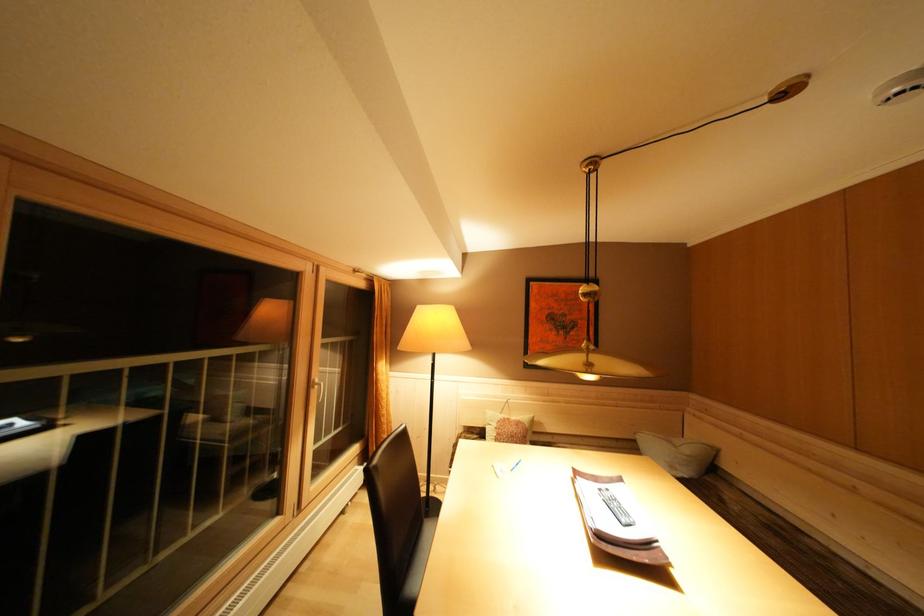
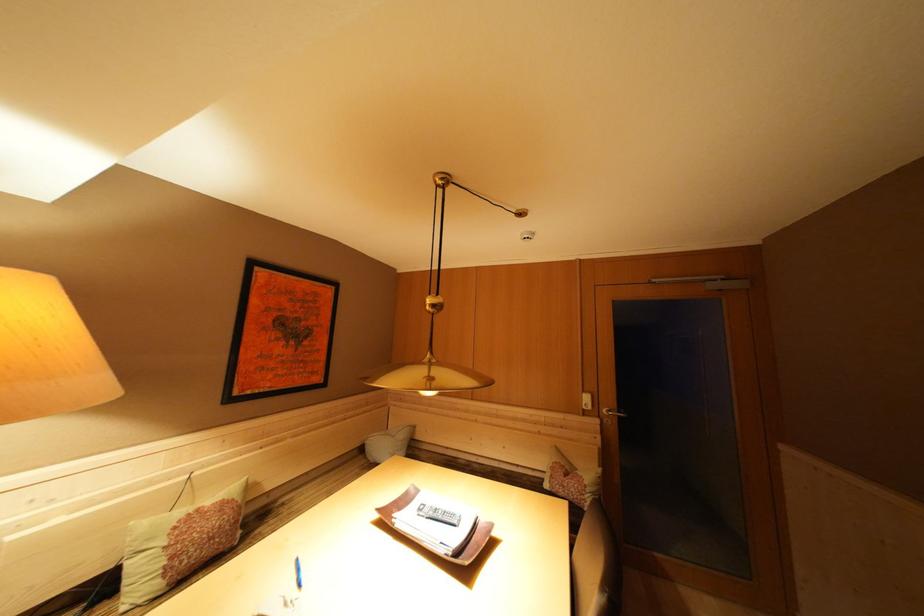
The point at (596,355) is marked in the first image. Where is the corresponding point in the second image?

(438, 369)